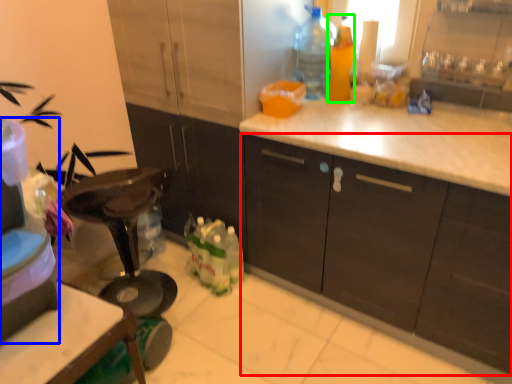
Question: Which object is the closest to the cabinetry (highlighted by a red box)? Choose among these: appliance (highlighted by a blue box) or bottle (highlighted by a green box).

Choices:
 (A) appliance
 (B) bottle

Answer: (B)